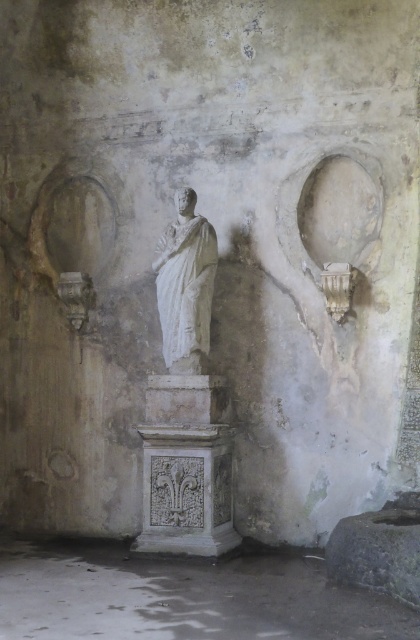
Is white marble pedestal at center taller than white marble statue at center?

Incorrect, white marble pedestal at center's height is not larger of white marble statue at center's.

Where is `white marble pedestal at center`? white marble pedestal at center is located at coordinates (186, 467).

Which is behind, point (0, 554) or point (201, 243)?

Point (0, 554)

Is white marble pedestal at lower center smaller than white marble statue at center?

No.

Is point (47, 582) in front of point (201, 301)?

That is True.

Where is `white marble pedestal at lower center`? The image size is (420, 640). white marble pedestal at lower center is located at coordinates (183, 595).

Can you confirm if white marble pedestal at lower center is positioned below white marble pedestal at center?

Yes, white marble pedestal at lower center is below white marble pedestal at center.

Is point (273, 609) less distant than point (186, 541)?

Yes, point (273, 609) is closer to viewer.

The height and width of the screenshot is (640, 420). In order to click on white marble pedestal at lower center in this screenshot , I will do `click(183, 595)`.